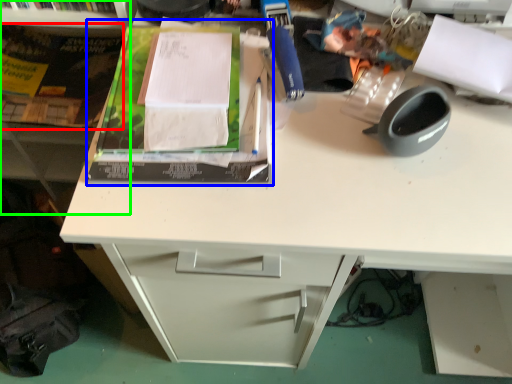
Question: Which object is the farthest from paperback book (highlighted by a red box)? Choose among these: paperback book (highlighted by a blue box) or bookshelf (highlighted by a green box).

Choices:
 (A) paperback book
 (B) bookshelf

Answer: (A)